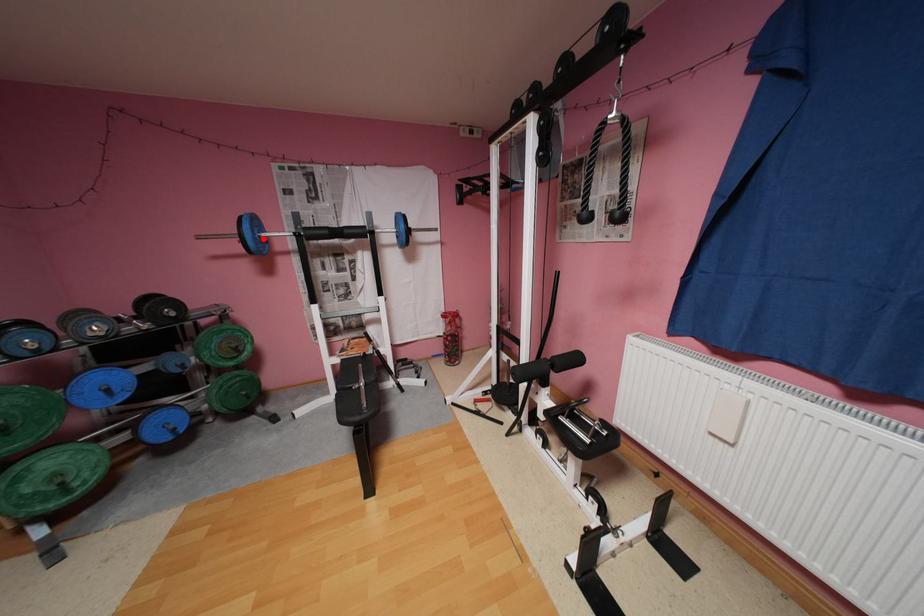
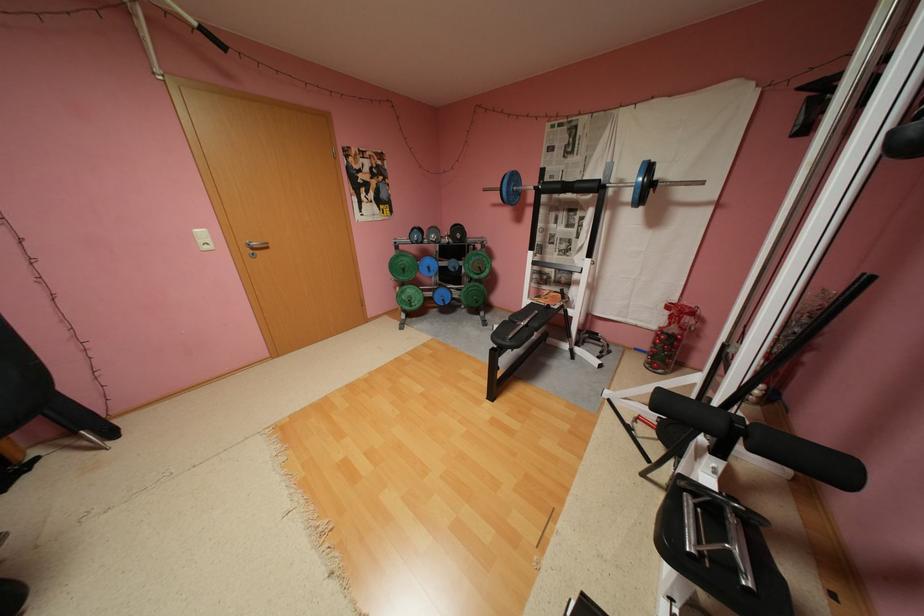
Locate, in the second image, the point that corresponds to the highlighted location in the first image.

(517, 191)